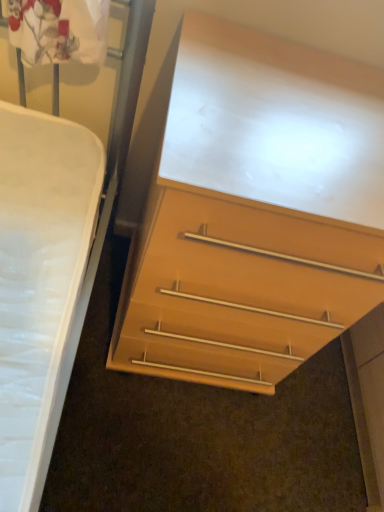
Where is `free space in front of light wood/wooden chest of drawers at center`? free space in front of light wood/wooden chest of drawers at center is located at coordinates (157, 441).